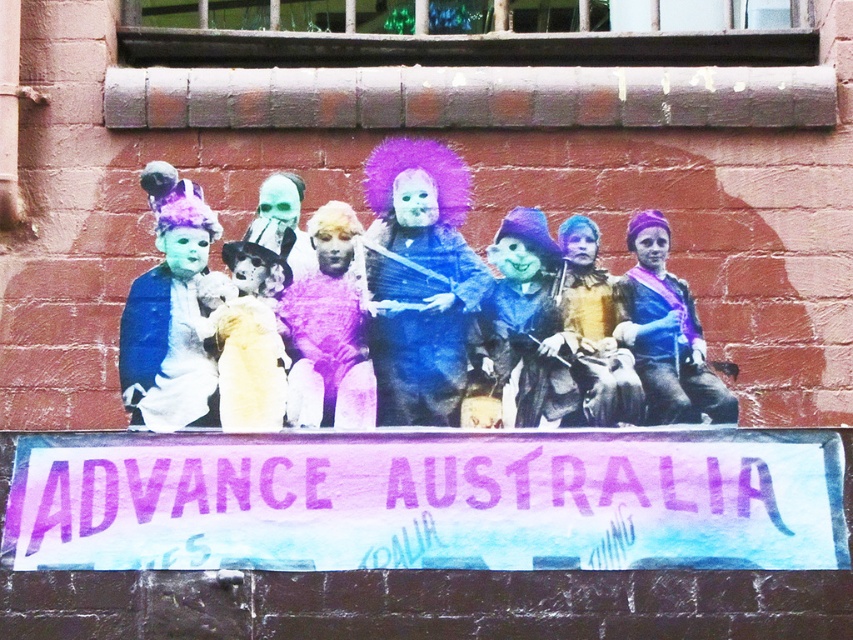
Which is more to the left, purple fuzzy sweater at center or matte blue fabric at center?

Positioned to the left is purple fuzzy sweater at center.

From the picture: Does purple fuzzy sweater at center have a greater width compared to matte blue fabric at center?

No.

Is point (299, 339) closer to camera compared to point (636, 276)?

Yes, it is.

The height and width of the screenshot is (640, 853). What are the coordinates of `purple fuzzy sweater at center` in the screenshot? It's located at (328, 330).

Between matte blue fabric at left and blue matte witch hat at center, which one has less height?

blue matte witch hat at center is shorter.

The height and width of the screenshot is (640, 853). Describe the element at coordinates (169, 310) in the screenshot. I see `matte blue fabric at left` at that location.

Measure the distance between matte blue fabric at left and camera.

52.42 feet

Locate an element on the screen. Image resolution: width=853 pixels, height=640 pixels. matte blue fabric at left is located at coordinates (169, 310).

Who is lower down, matte blue costume at center or matte blue fabric at center?

matte blue fabric at center is lower down.

Between matte blue costume at center and matte blue fabric at center, which one is positioned higher?

matte blue costume at center is higher up.

Is point (254, 406) closer to camera compared to point (657, 353)?

Yes, it is.

Where is `matte blue costume at center`? Image resolution: width=853 pixels, height=640 pixels. matte blue costume at center is located at coordinates (416, 323).